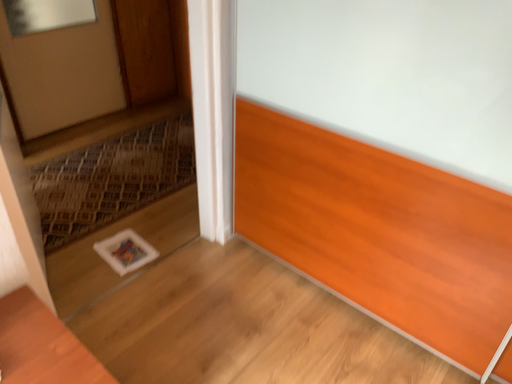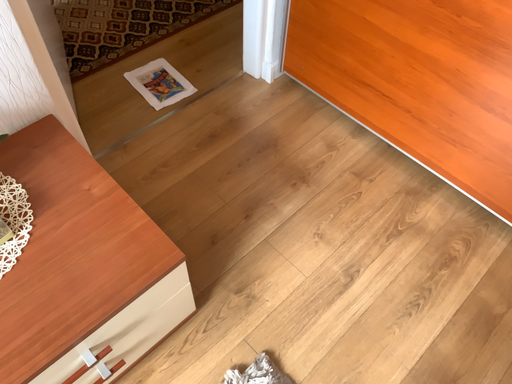
Question: Which way did the camera rotate in the video?

Choices:
 (A) rotated downward
 (B) rotated upward

Answer: (A)